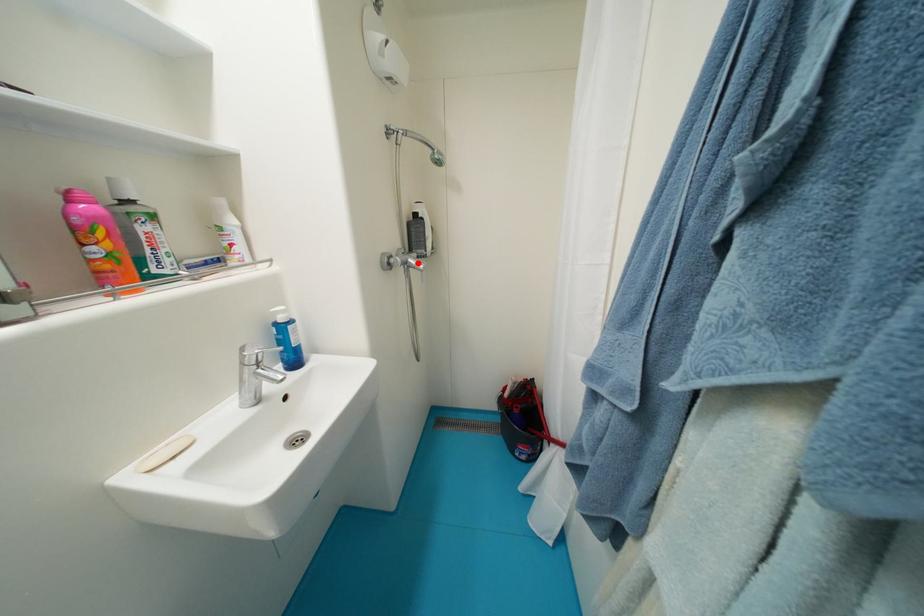
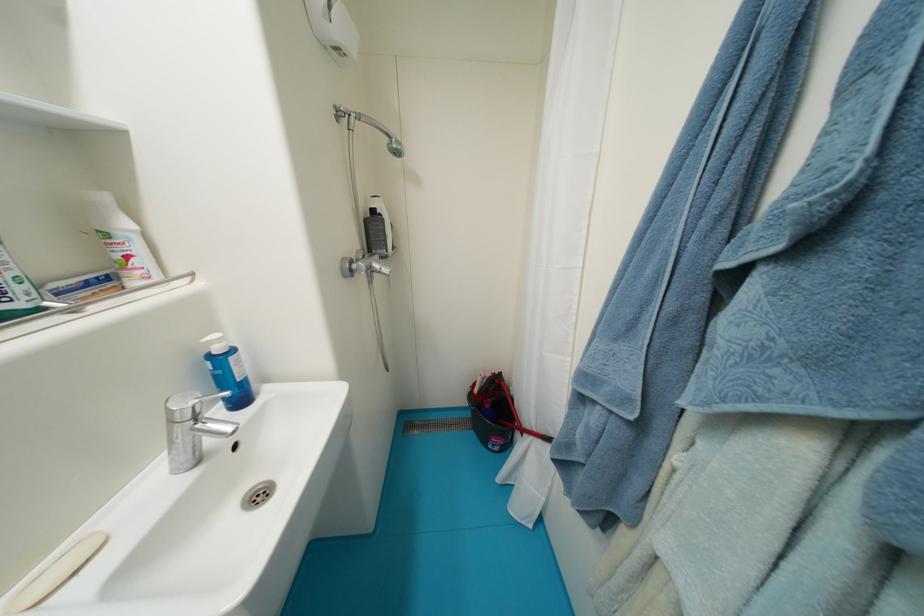
In the second image, find the point that corresponds to the highlighted location in the first image.

(383, 267)